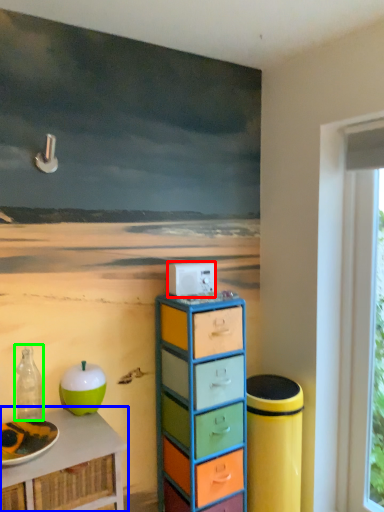
Question: Estimate the real-world distances between objects in this image. Which object is closer to appliance (highlighted by a red box), table (highlighted by a blue box) or bottle (highlighted by a green box)?

Choices:
 (A) table
 (B) bottle

Answer: (B)